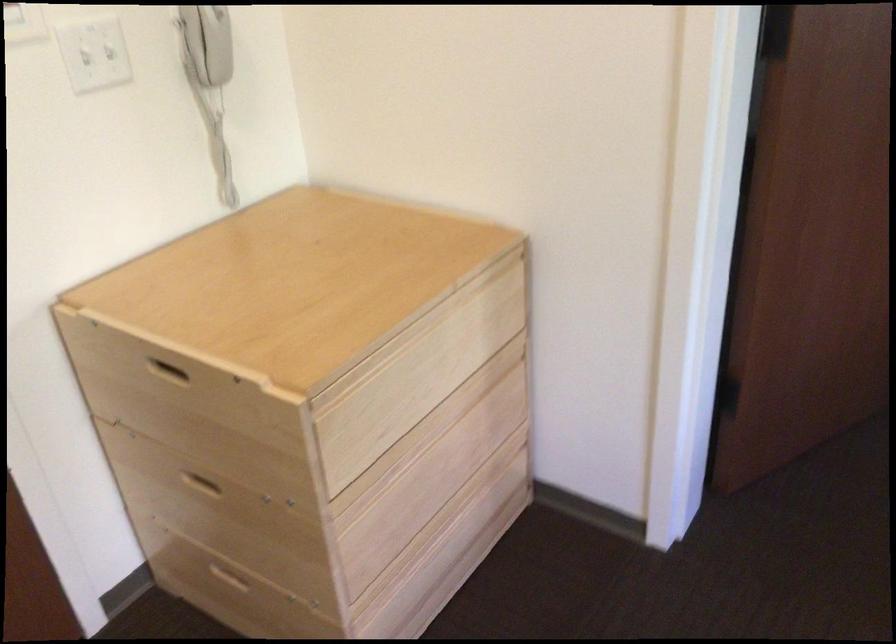
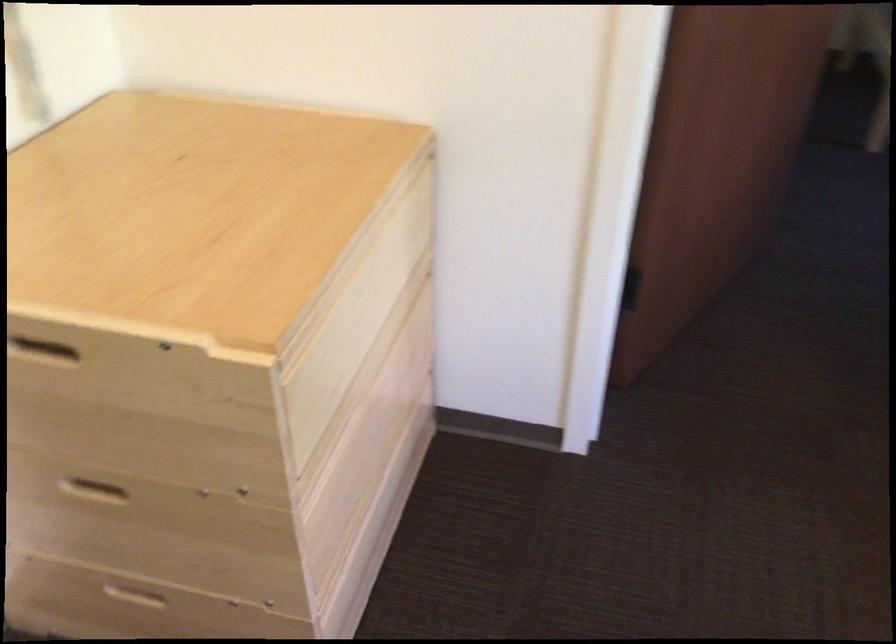
In the second image, find the point that corresponds to [201,486] in the first image.

(90, 488)